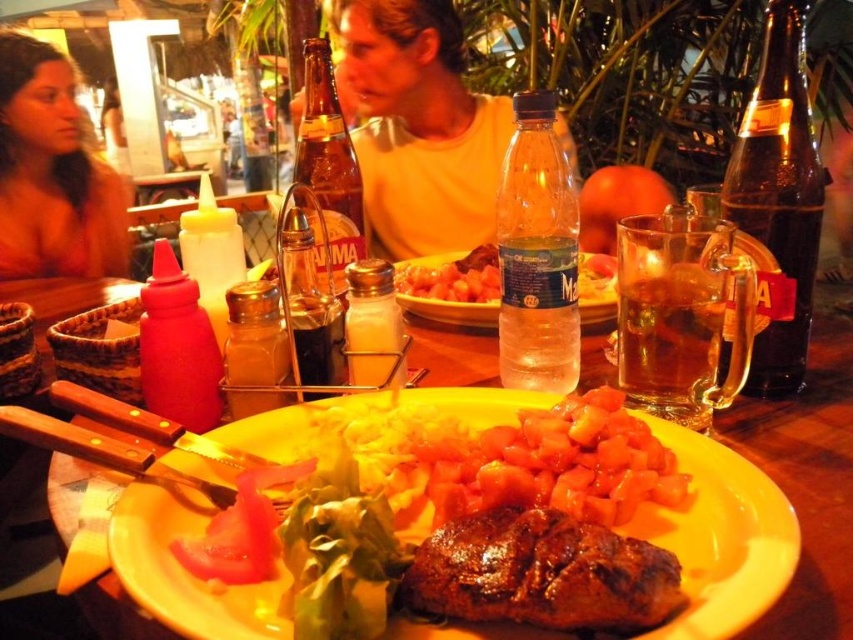
Question: Which point is farther to the camera?

Choices:
 (A) (351, 312)
 (B) (680, 301)
 (C) (338, 198)
 (D) (160, 317)

Answer: (C)

Question: Estimate the real-world distances between objects in this image. Which object is closer to the translucent glass salt shaker at center?

Choices:
 (A) tomato sauce at center
 (B) clear plastic bottle at center
 (C) translucent glass bottle at center
 (D) brown seared steak at center

Answer: (C)

Question: Which point is closer to the camera?

Choices:
 (A) clear plastic bottle at center
 (B) translucent glass bottle at center

Answer: (B)

Question: Is matte yellow plate at center bigger than brown seared steak at center?

Choices:
 (A) yes
 (B) no

Answer: (A)

Question: Does translucent glass mug at center right appear over translucent plastic water at center?

Choices:
 (A) yes
 (B) no

Answer: (B)

Question: From the image, what is the correct spatial relationship of translucent glass bottle at right in relation to matte plastic ketchup bottle at left?

Choices:
 (A) right
 (B) left

Answer: (A)